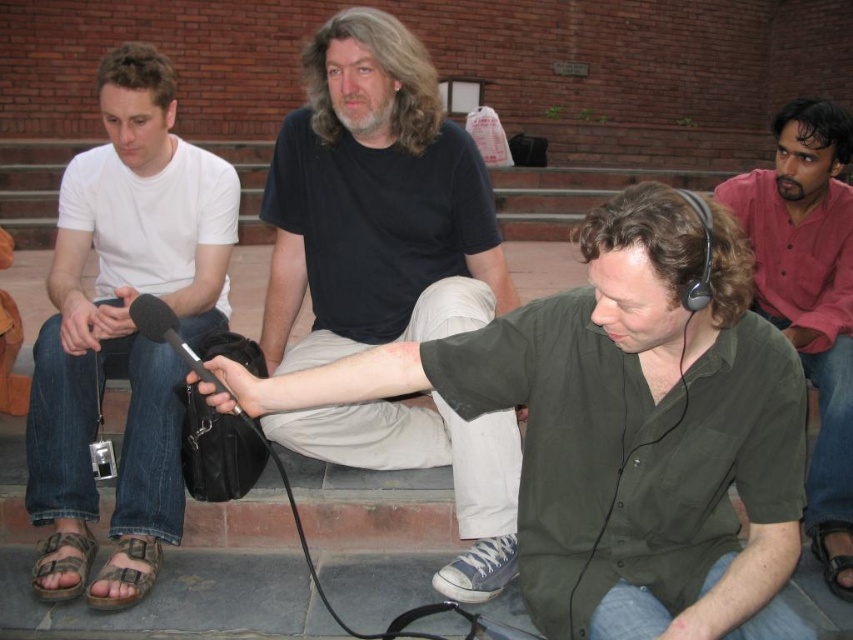
Question: Which point appears farthest from the camera in this image?

Choices:
 (A) (845, 572)
 (B) (415, 324)
 (C) (94, 598)

Answer: (B)

Question: Is white cotton shirt at left below brown canvas sandal at lower left?

Choices:
 (A) yes
 (B) no

Answer: (B)

Question: Can you confirm if green matte shirt at center is thinner than black matte microphone at center?

Choices:
 (A) yes
 (B) no

Answer: (B)

Question: Which of the following is the farthest from the observer?

Choices:
 (A) (68, 554)
 (B) (144, 576)
 (C) (827, 573)
 (D) (728, 628)

Answer: (C)

Question: Which object is farther from the camera taking this photo?

Choices:
 (A) brown fabric sandal at lower left
 (B) black matte microphone at center
 (C) brown leather sandal at lower right
 (D) green matte shirt at center

Answer: (C)

Question: Observing the image, what is the correct spatial positioning of black matte microphone at center in reference to brown leather sandal at lower right?

Choices:
 (A) left
 (B) right

Answer: (A)